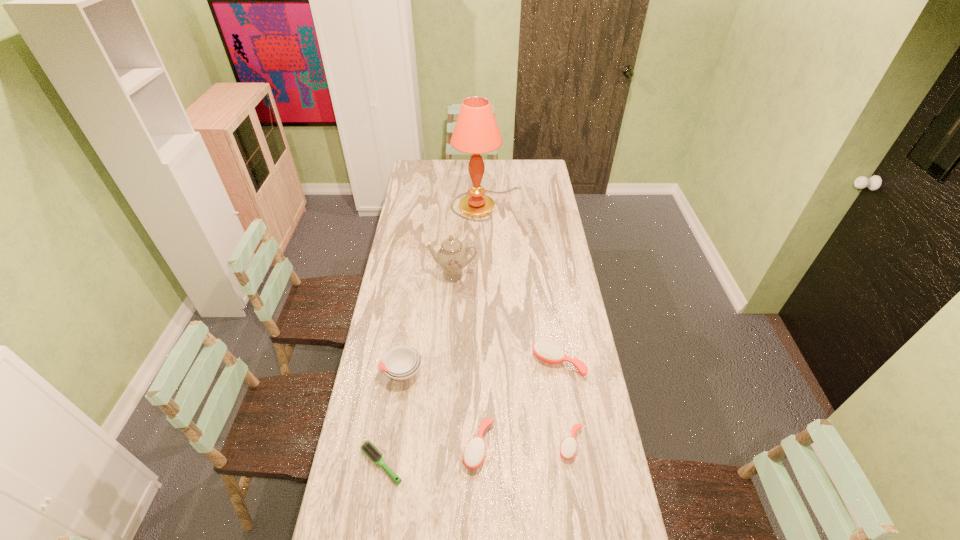
Identify which object is the third closest to the pink lamp. Please provide its 2D coordinates. Your answer should be formatted as a tuple, i.e. [(x, y)], where the tuple contains the x and y coordinates of a point satisfying the conditions above.

[(401, 363)]

Where is `object that is the nearest to the smallest orange hairbrush`? This screenshot has height=540, width=960. object that is the nearest to the smallest orange hairbrush is located at coordinates (546, 350).

Find the location of a particular element. the closest hairbrush to the second tallest object is located at coordinates (546, 350).

I want to click on hairbrush that is the third closest to the third shortest object, so click(546, 350).

Find the location of a particular element. The image size is (960, 540). the closest orange hairbrush to the pink lamp is located at coordinates (546, 350).

Locate which orange hairbrush is the second closest to the smallest orange hairbrush. Please provide its 2D coordinates. Your answer should be formatted as a tuple, i.e. [(x, y)], where the tuple contains the x and y coordinates of a point satisfying the conditions above.

[(474, 453)]

Locate an element on the screen. vacant region that satisfies the following two spatial constraints: 1. on the back side of the leftmost hairbrush; 2. on the left side of the farthest hairbrush is located at coordinates (397, 362).

At what (x,y) coordinates should I click in order to perform the action: click on free space that satisfies the following two spatial constraints: 1. on the spout of the tallest hairbrush; 2. on the right side of the chinaware. Please return your answer as a coordinate pair (x, y). Looking at the image, I should click on (447, 362).

Locate an element on the screen. vacant area in the image that satisfies the following two spatial constraints: 1. on the spout of the second farthest object; 2. on the right side of the farthest orange hairbrush is located at coordinates (447, 362).

Identify the location of free location that satisfies the following two spatial constraints: 1. on the front side of the leftmost orange hairbrush; 2. on the right side of the white soup bowl. (392, 446).